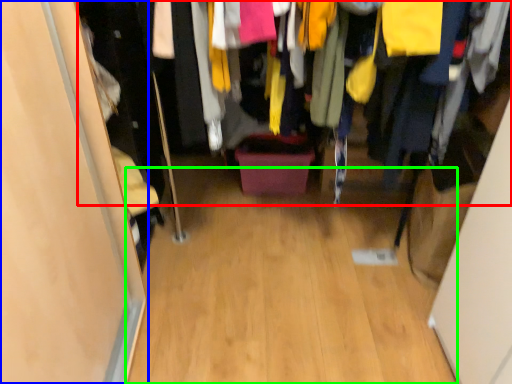
Question: Considering the real-world distances, which object is farthest from closet (highlighted by a red box)? door (highlighted by a blue box) or plain (highlighted by a green box)?

Choices:
 (A) door
 (B) plain

Answer: (B)